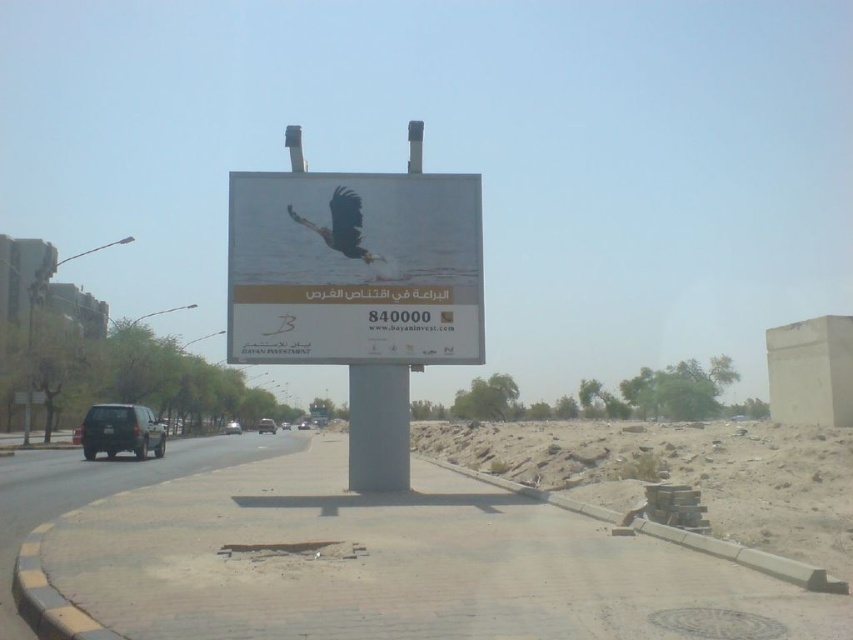
Is metallic billboard at center bigger than gray metallic pole at center?

Correct, metallic billboard at center is larger in size than gray metallic pole at center.

Does point (291, 180) come closer to viewer compared to point (360, 388)?

No, it is behind (360, 388).

Image resolution: width=853 pixels, height=640 pixels. I want to click on metallic billboard at center, so click(354, 268).

Which is above, matte black suv at lower left or silver metallic car at center?

matte black suv at lower left

Which is below, matte black suv at lower left or silver metallic car at center?

Positioned lower is silver metallic car at center.

You are a GUI agent. You are given a task and a screenshot of the screen. Output one action in this format:
    pyautogui.click(x=<x>, y=<y>)
    Task: Click on the matte black suv at lower left
    This screenshot has width=853, height=640.
    Given the screenshot: What is the action you would take?
    pyautogui.click(x=120, y=429)

Who is higher up, dark brown feathers at center or metallic silver car at center?

dark brown feathers at center is above.

Who is more distant from viewer, (351, 225) or (299, 422)?

Positioned behind is point (299, 422).

This screenshot has height=640, width=853. I want to click on dark brown feathers at center, so click(x=341, y=225).